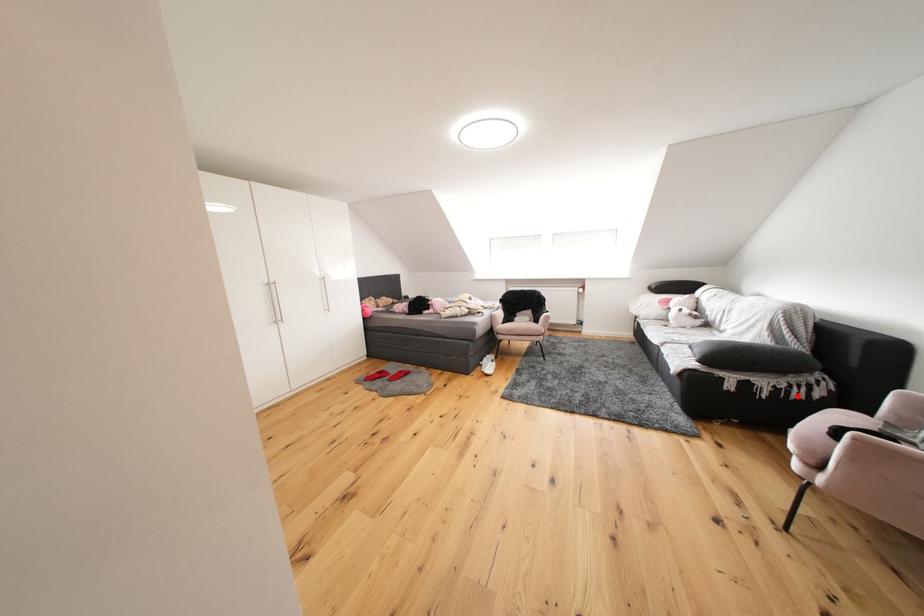
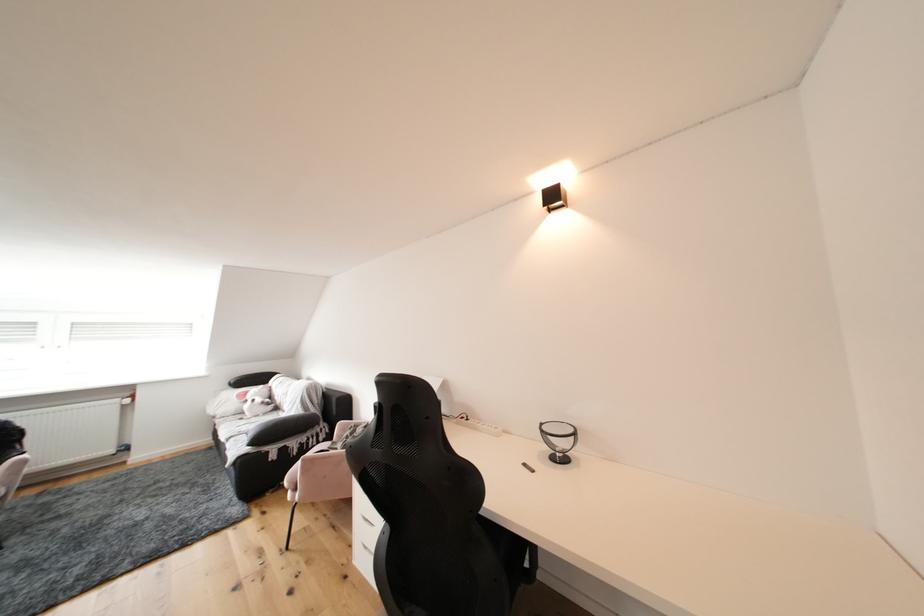
Question: A red point is marked in image1. In image2, is the corresponding 3D point closer to the camera or farther? Reply with the corresponding letter.

Choices:
 (A) The corresponding 3D point is closer.
 (B) The corresponding 3D point is farther.

Answer: (B)